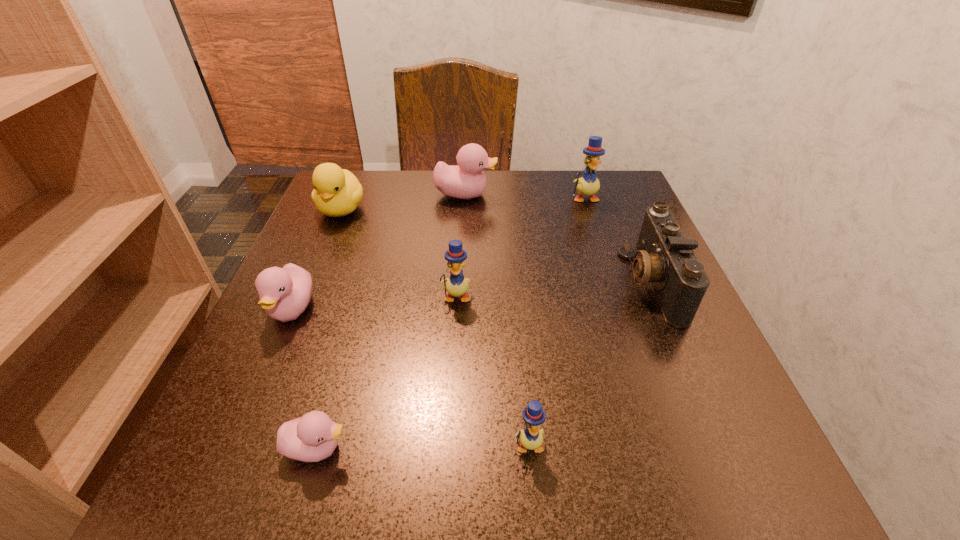
At what (x,y) coordinates should I click in order to perform the action: click on empty space that is in between the duck and the second farthest yellow duckling. Please return your answer as a coordinate pair (x, y). Looking at the image, I should click on (398, 253).

At what (x,y) coordinates should I click in order to perform the action: click on free space between the farthest yellow duckling and the duck. Please return your answer as a coordinate pair (x, y). Looking at the image, I should click on (463, 204).

At what (x,y) coordinates should I click in order to perform the action: click on free space between the leftmost pink duckling and the biggest pink duckling. Please return your answer as a coordinate pair (x, y). Looking at the image, I should click on (379, 252).

The height and width of the screenshot is (540, 960). What are the coordinates of `empty space that is in between the leftmost pink duckling and the camera` in the screenshot? It's located at (472, 296).

I want to click on vacant area between the sixth object from left to right and the leftmost yellow duckling, so click(492, 370).

At what (x,y) coordinates should I click in order to perform the action: click on free space between the leftmost pink duckling and the rightmost duckling. Please return your answer as a coordinate pair (x, y). Image resolution: width=960 pixels, height=540 pixels. Looking at the image, I should click on (439, 254).

Locate which object ranks fifth in proximity to the biggest pink duckling. Please provide its 2D coordinates. Your answer should be formatted as a tuple, i.e. [(x, y)], where the tuple contains the x and y coordinates of a point satisfying the conditions above.

[(285, 292)]

Locate which object ranks seventh in proximity to the biggest yellow duckling. Please provide its 2D coordinates. Your answer should be formatted as a tuple, i.e. [(x, y)], where the tuple contains the x and y coordinates of a point satisfying the conditions above.

[(311, 438)]

Select which duckling is the fifth closest to the smallest yellow duckling. Please provide its 2D coordinates. Your answer should be formatted as a tuple, i.e. [(x, y)], where the tuple contains the x and y coordinates of a point satisfying the conditions above.

[(588, 184)]

Point out which duckling is positioned as the fifth nearest to the second nearest pink duckling. Please provide its 2D coordinates. Your answer should be formatted as a tuple, i.e. [(x, y)], where the tuple contains the x and y coordinates of a point satisfying the conditions above.

[(588, 184)]